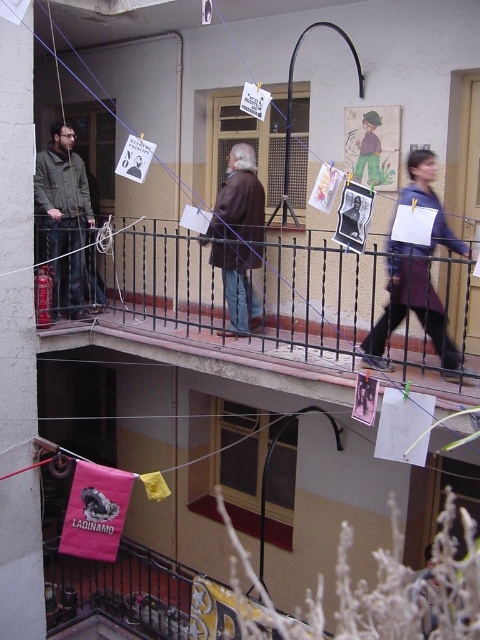
Measure the distance from matte black jacket at left to smooth brown coat at center.

The distance of matte black jacket at left from smooth brown coat at center is 3.11 meters.

Is matte black jacket at left closer to the viewer compared to smooth brown coat at center?

No, it is behind smooth brown coat at center.

The height and width of the screenshot is (640, 480). I want to click on matte black jacket at left, so click(x=63, y=216).

The height and width of the screenshot is (640, 480). In order to click on matte black jacket at left in this screenshot , I will do `click(63, 216)`.

Is metallic balcony at center above purple fabric dress at center?

No, metallic balcony at center is not above purple fabric dress at center.

Is point (203, 273) farther from viewer compared to point (419, 264)?

Yes.

Does point (269, 371) lie behind point (399, 296)?

That is True.

The height and width of the screenshot is (640, 480). I want to click on metallic balcony at center, so click(x=224, y=305).

Which is below, brown leather jacket at center or smooth brown coat at center?

smooth brown coat at center is lower down.

In the scene shown: Is brown leather jacket at center smaller than smooth brown coat at center?

No, brown leather jacket at center is not smaller than smooth brown coat at center.

Which is in front, point (230, 163) or point (350, 234)?

Point (350, 234)

Image resolution: width=480 pixels, height=640 pixels. What are the coordinates of `brown leather jacket at center` in the screenshot? It's located at (239, 198).